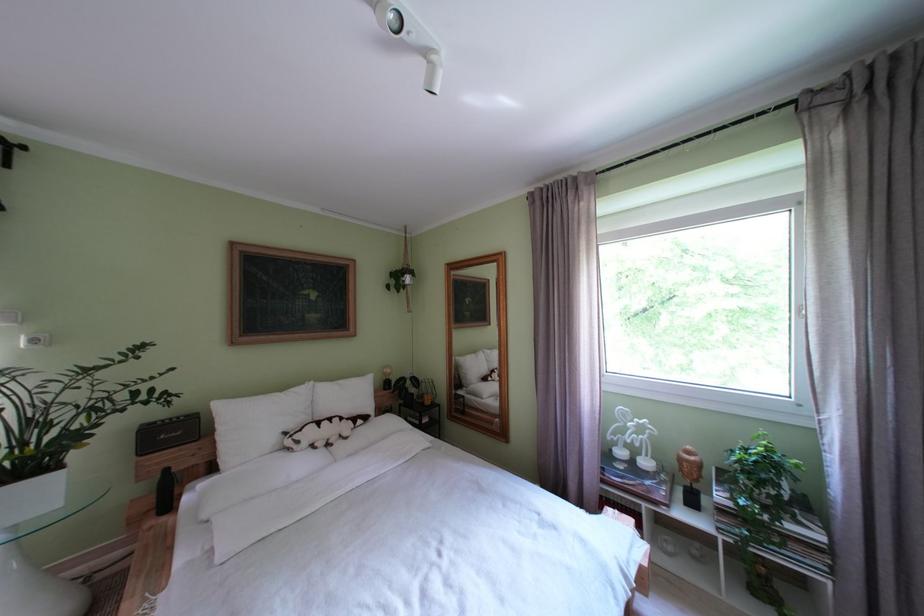
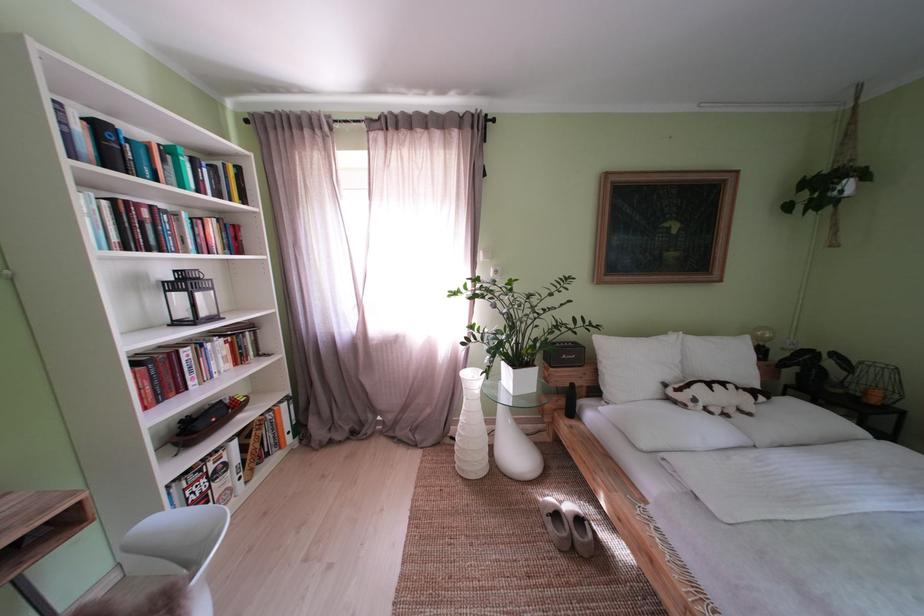
Where in the second image is the point corresponding to (261,429) from the first image?

(639, 369)